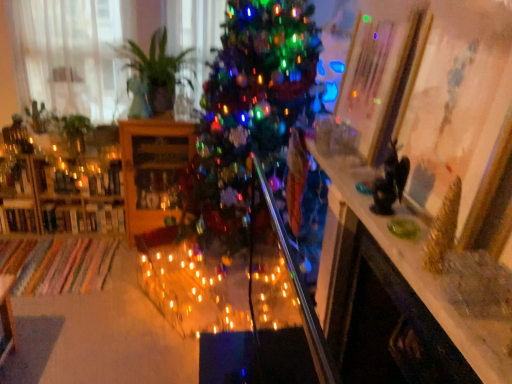
Question: Is wooden bookshelf at left, arranged as the first shelf when viewed from the left, situated inside shiny metallic table at upper right or outside?

Choices:
 (A) outside
 (B) inside

Answer: (A)

Question: Looking at their shapes, would you say wooden bookshelf at left, arranged as the first shelf when viewed from the left, is wider or thinner than shiny metallic table at upper right?

Choices:
 (A) wide
 (B) thin

Answer: (A)

Question: Which object is the farthest from the green leafy plant at left?

Choices:
 (A) white sheer curtain at left
 (B) wooden bookshelf at left, which appears as the 2th shelf when viewed from the right
 (C) green glossy plant at upper left
 (D) shiny green christmas tree at center
 (E) wooden cabinet at center, the first shelf in the right-to-left sequence

Answer: (D)

Question: Which of these objects is positioned farthest from the green glossy plant at upper left?

Choices:
 (A) shiny metallic table at upper right
 (B) green leafy plant at left
 (C) white sheer curtain at left
 (D) wooden cabinet at center, the first shelf in the right-to-left sequence
 (E) shiny green christmas tree at center

Answer: (A)